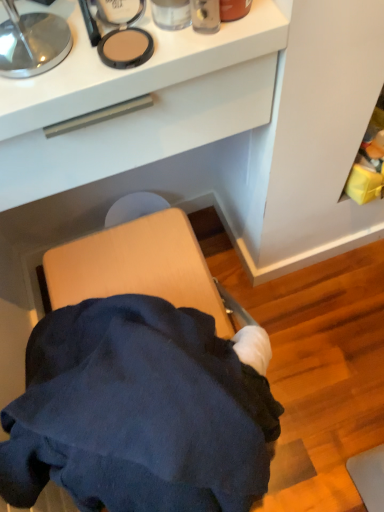
Question: In the image, is matte plastic container at upper center on the left side or the right side of white matte drawer at upper center?

Choices:
 (A) left
 (B) right

Answer: (B)

Question: Looking at the image, does matte plastic container at upper center seem bigger or smaller compared to white matte drawer at upper center?

Choices:
 (A) big
 (B) small

Answer: (B)

Question: From the image's perspective, is matte plastic container at upper center above or below white matte drawer at upper center?

Choices:
 (A) above
 (B) below

Answer: (A)

Question: In the image, is white matte drawer at upper center on the left side or the right side of matte plastic container at upper center?

Choices:
 (A) right
 (B) left

Answer: (B)

Question: In terms of height, does white matte drawer at upper center look taller or shorter compared to matte plastic container at upper center?

Choices:
 (A) tall
 (B) short

Answer: (A)

Question: Is white matte drawer at upper center wider or thinner than matte plastic container at upper center?

Choices:
 (A) wide
 (B) thin

Answer: (A)

Question: Is point (163, 138) closer or farther from the camera than point (155, 23)?

Choices:
 (A) farther
 (B) closer

Answer: (A)